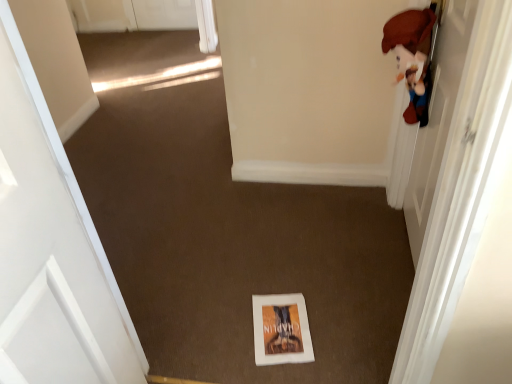
Locate an element on the screen. The height and width of the screenshot is (384, 512). vacant space to the right of white paper book at center is located at coordinates (342, 323).